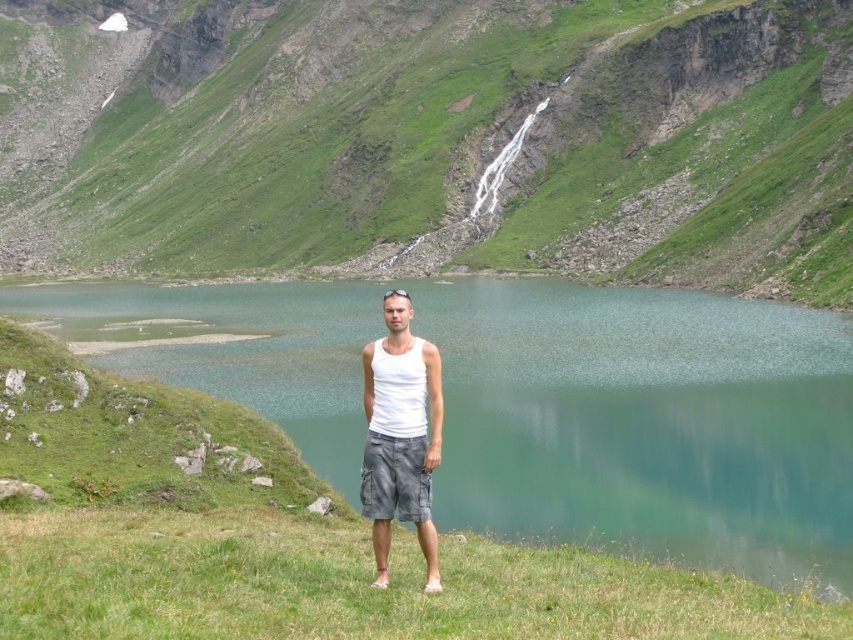
You are a photographer trying to capture the man in the scene. You have two points marked on your camera screen, point A at coordinates point (498, 524) and point B at coordinates point (404, 476). Which point is closer to the man?

Point A at coordinates point (498, 524) is closer to the man because it is further to the viewer than point B at coordinates point (404, 476).

Consider the image. You are a photographer wanting to capture the man and the lake in one shot. Since you want the man to be in focus, which object should you avoid placing in front of him? Please choose between the green smooth water at center and the green grassy at lower center.

The green grassy at lower center is behind the green smooth water at center. To ensure the man is in focus, avoid placing the green smooth water at center in front of him as it is closer to the camera than the green grassy at lower center.

You are standing at the point where the man is in the image. Which direction should you walk to reach the green grassy hillside at center?

The green grassy hillside at center is already at your current position since the man is standing on it.